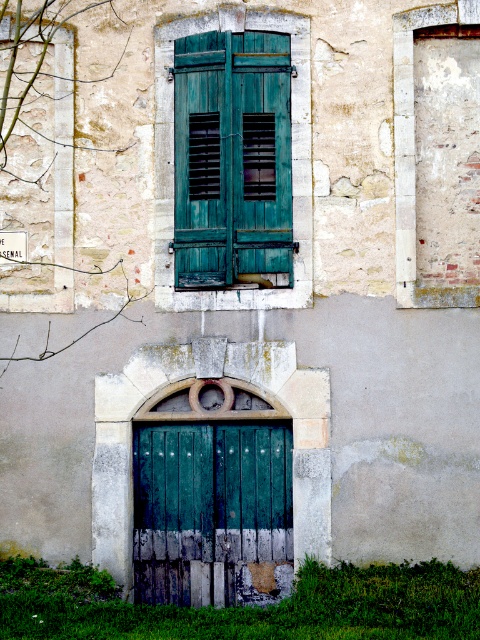
Question: Which point is closer to the camera taking this photo?

Choices:
 (A) (228, 172)
 (B) (235, 557)

Answer: (A)

Question: Can you confirm if teal wood shutters at center is smaller than green wooden door at center?

Choices:
 (A) yes
 (B) no

Answer: (B)

Question: Does teal wood shutters at center appear on the left side of green wooden door at center?

Choices:
 (A) yes
 (B) no

Answer: (B)

Question: Which object is closer to the camera taking this photo?

Choices:
 (A) green wooden door at center
 (B) teal wood shutters at center

Answer: (B)

Question: Does teal wood shutters at center lie in front of green wooden door at center?

Choices:
 (A) yes
 (B) no

Answer: (A)

Question: Which point is closer to the camera taking this photo?

Choices:
 (A) (244, 200)
 (B) (153, 492)

Answer: (A)